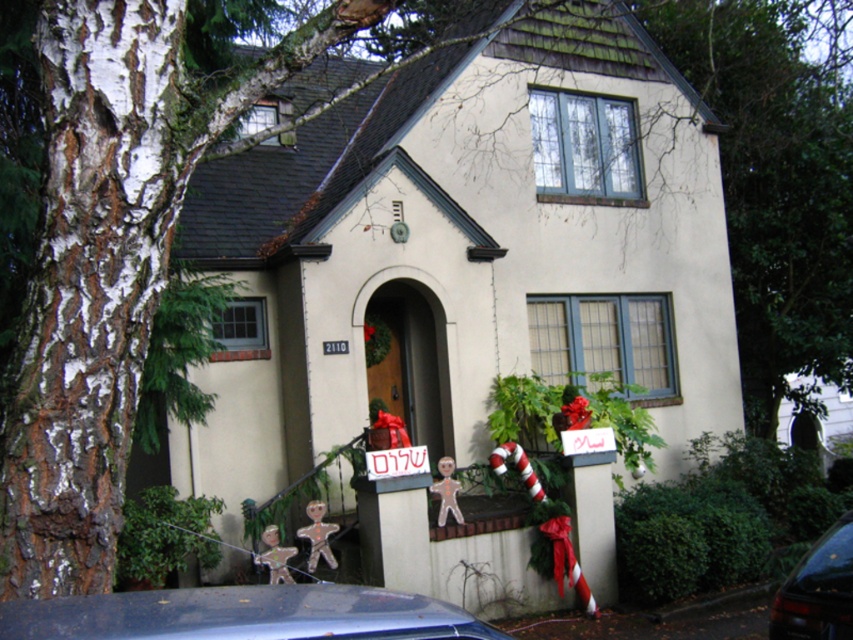
Question: Does metallic blue car at lower left have a lesser width compared to metallic dark blue car at lower right?

Choices:
 (A) no
 (B) yes

Answer: (A)

Question: Can you confirm if metallic blue car at lower left is bigger than metallic dark blue car at lower right?

Choices:
 (A) yes
 (B) no

Answer: (B)

Question: Among these points, which one is nearest to the camera?

Choices:
 (A) (183, 588)
 (B) (846, 554)

Answer: (B)

Question: Which of the following is the farthest from the observer?

Choices:
 (A) metallic blue car at lower left
 (B) metallic dark blue car at lower right

Answer: (B)

Question: Can you confirm if metallic blue car at lower left is bigger than metallic dark blue car at lower right?

Choices:
 (A) yes
 (B) no

Answer: (B)

Question: Among these objects, which one is farthest from the camera?

Choices:
 (A) metallic dark blue car at lower right
 (B) metallic blue car at lower left

Answer: (A)